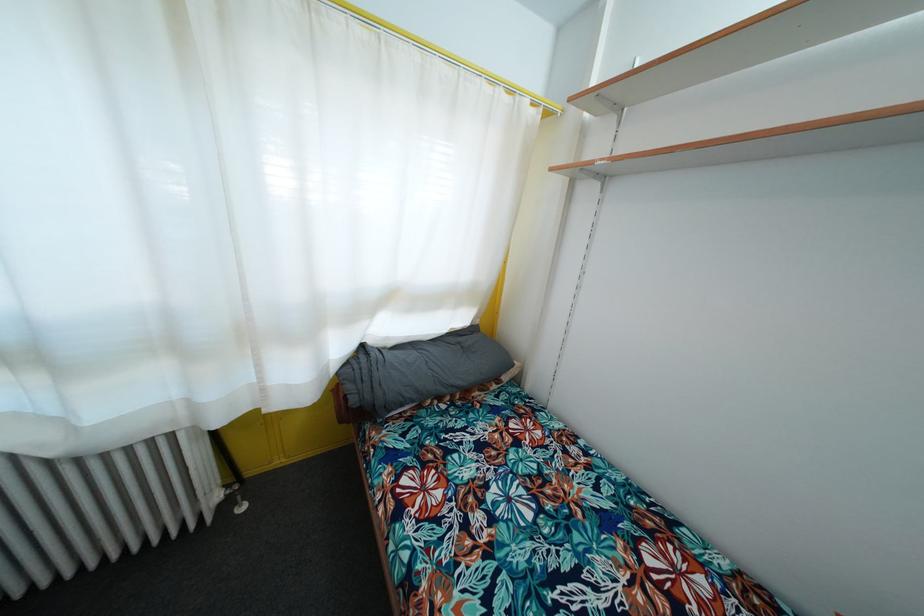
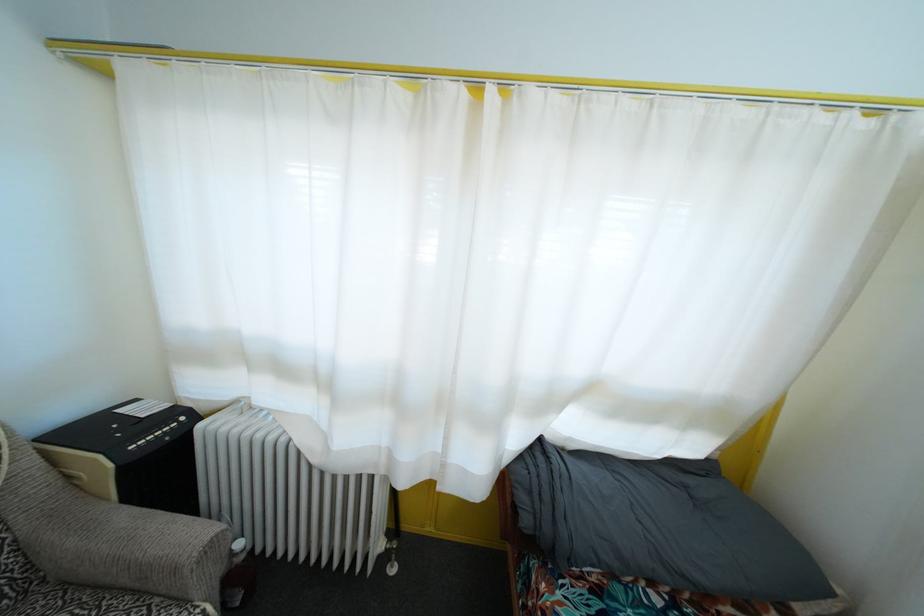
Question: Based on the continuous images, in which direction is the camera rotating? Reply with the corresponding letter.

Choices:
 (A) Left
 (B) Right
 (C) Up
 (D) Down

Answer: (A)